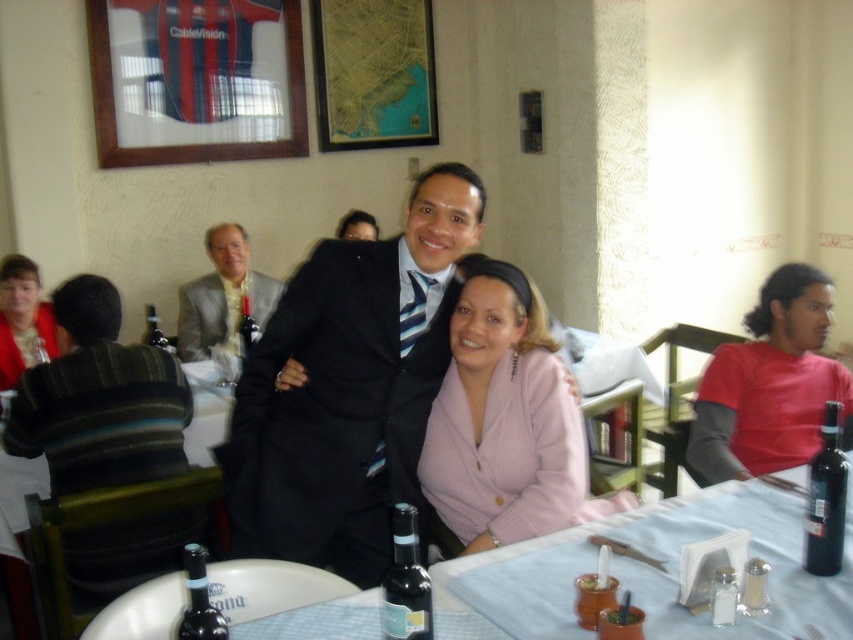
Question: Is red cotton shirt at right closer to camera compared to matte red sweater at left?

Choices:
 (A) no
 (B) yes

Answer: (B)

Question: Which point is farther to the camera?

Choices:
 (A) black glass bottle at lower right
 (B) matte red sweater at left
 (C) matte black suit at center

Answer: (B)

Question: Estimate the real-world distances between objects in this image. Which object is farther from the black glass bottle at lower right?

Choices:
 (A) pink fleece jacket at center
 (B) light brown suit at center

Answer: (B)

Question: Does light brown suit at center lie behind dark glass bottle at center?

Choices:
 (A) no
 (B) yes

Answer: (B)

Question: Which point is farther to the camera?

Choices:
 (A) light brown suit at center
 (B) pink fleece jacket at center
 (C) blue checkered tablecloth at center

Answer: (A)

Question: Is striped wool sweater at left behind light brown suit at center?

Choices:
 (A) yes
 (B) no

Answer: (B)